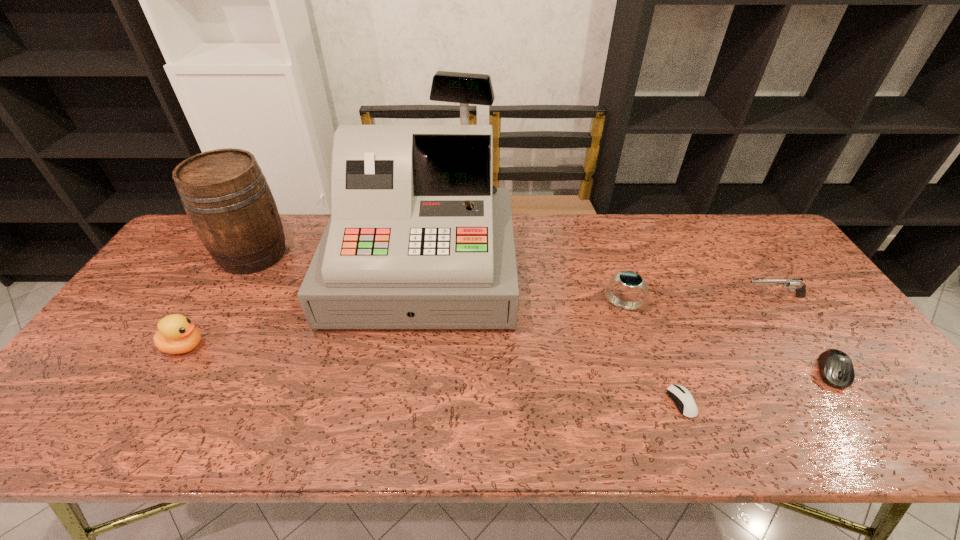
This screenshot has height=540, width=960. I want to click on vacant point located on the keypad side of the fifth object from right to left, so click(x=411, y=352).

At what (x,y) coordinates should I click in order to perform the action: click on free space located 0.280m on the side of the cider near the bung hole. Please return your answer as a coordinate pair (x, y). The height and width of the screenshot is (540, 960). Looking at the image, I should click on (378, 254).

Image resolution: width=960 pixels, height=540 pixels. Find the location of `free space located 0.200m on the face of the duckling`. free space located 0.200m on the face of the duckling is located at coordinates (284, 347).

Identify the location of free space located on the back of the watch. The image size is (960, 540). (603, 245).

The image size is (960, 540). What are the coordinates of `vacant area located 0.090m on the front-facing side of the pistol` in the screenshot? It's located at (711, 297).

Locate an element on the screen. vacant space located 0.360m on the front-facing side of the pistol is located at coordinates (617, 297).

Identify the location of free space located on the front-facing side of the pistol. (638, 297).

Where is `free space located on the back of the right mouse`? This screenshot has width=960, height=540. free space located on the back of the right mouse is located at coordinates (756, 264).

You are a GUI agent. You are given a task and a screenshot of the screen. Output one action in this format:
    pyautogui.click(x=<x>, y=<y>)
    Task: Click on the free space located 0.120m on the right of the shorter mouse
    
    Given the screenshot: What is the action you would take?
    pyautogui.click(x=746, y=402)

The width and height of the screenshot is (960, 540). What are the coordinates of `cash register positioned at the far edge` in the screenshot? It's located at [x=419, y=237].